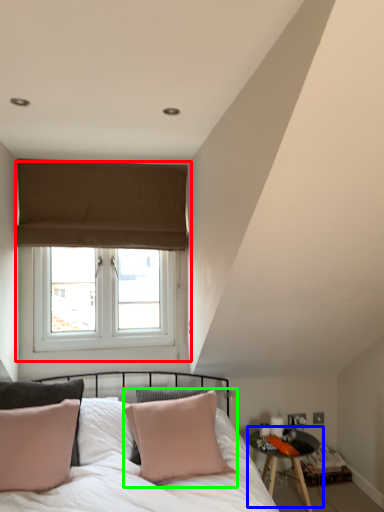
Question: Which object is the farthest from window (highlighted by a red box)? Choose among these: table (highlighted by a blue box) or pillow (highlighted by a green box).

Choices:
 (A) table
 (B) pillow

Answer: (A)